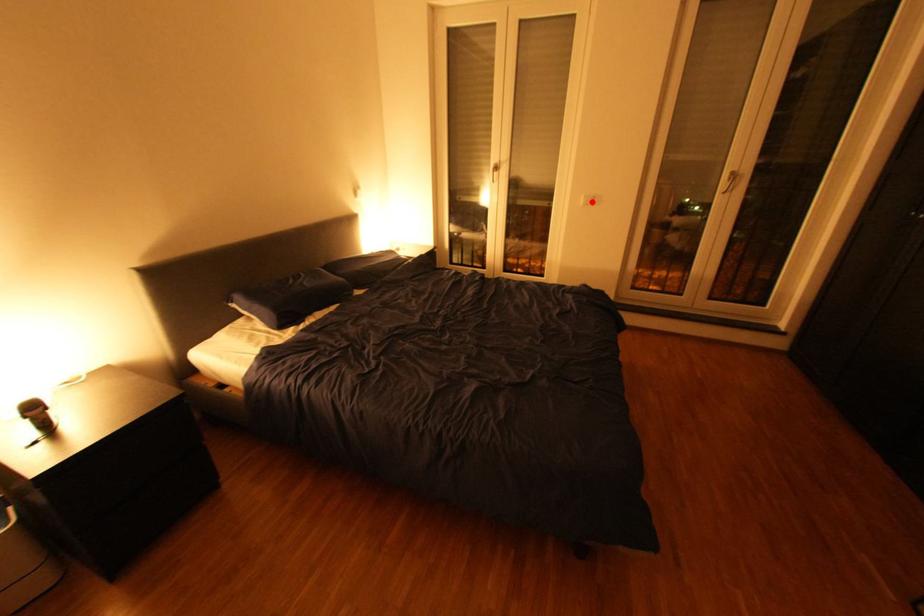
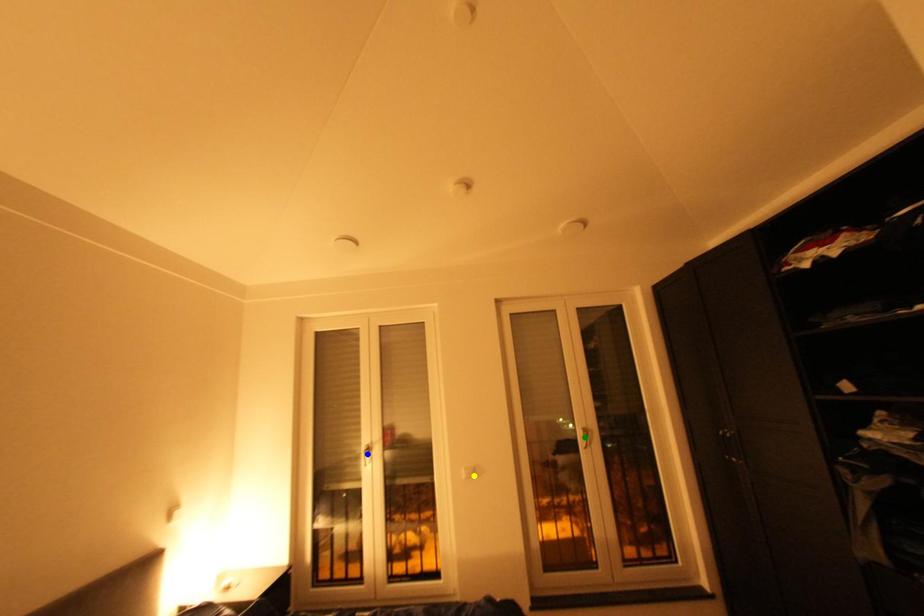
Question: I am providing you with two images of the same scene from different viewpoints. A red point is marked on the first image. You are given multiple points on the second image. Which point in image 2 represents the same 3d spot as the red point in image 1?

Choices:
 (A) green point
 (B) yellow point
 (C) blue point

Answer: (B)